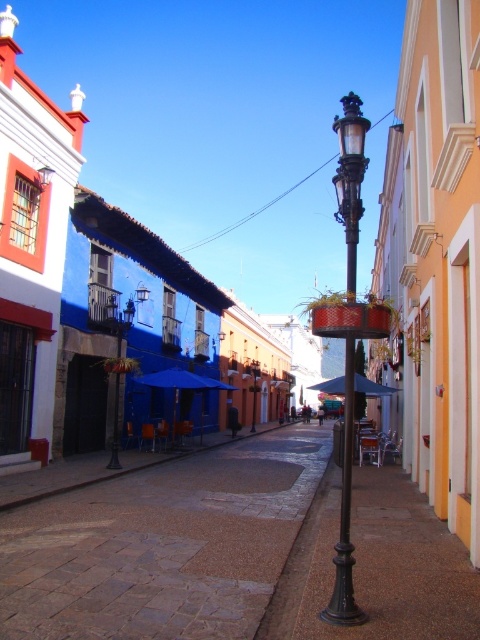
You are standing on the cobblestone street in the historic district. You see two points marked on the buildings. Which point, point (115, 362) or point (251, 376), is closer to you?

Point (115, 362) is closer to the viewer than point (251, 376).